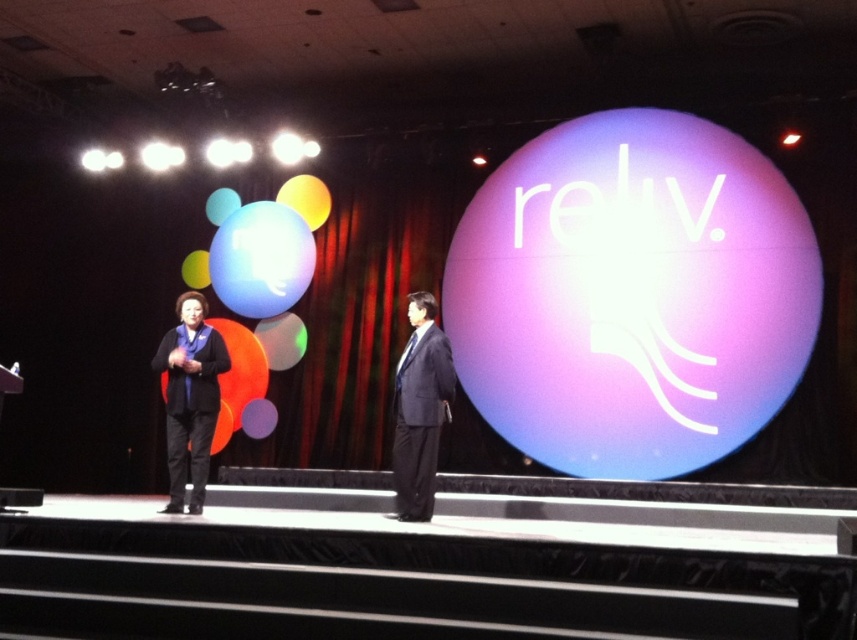
Between black matte business suit at left and black matte business suit at center, which one appears on the right side from the viewer's perspective?

black matte business suit at center is more to the right.

Between point (202, 461) and point (406, 397), which one is positioned behind?

The point (202, 461) is behind.

At what (x,y) coordinates should I click in order to perform the action: click on black matte business suit at left. Please return your answer as a coordinate pair (x, y). Looking at the image, I should click on (190, 406).